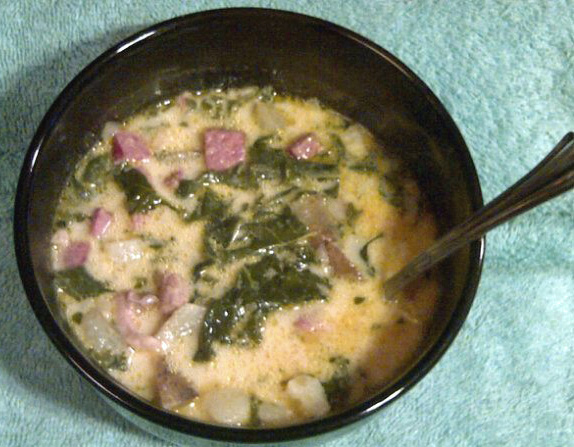
Identify the location of silverware. (523, 192).